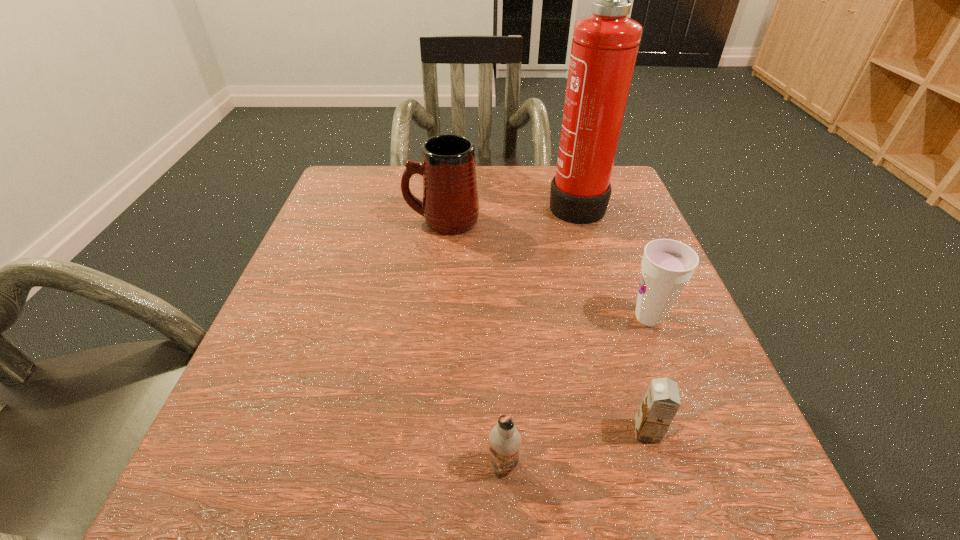
The width and height of the screenshot is (960, 540). I want to click on fire extinguisher, so click(x=604, y=49).

Where is `the second tallest object`? The width and height of the screenshot is (960, 540). the second tallest object is located at coordinates (450, 206).

Where is `the leftmost object`? the leftmost object is located at coordinates (450, 206).

This screenshot has width=960, height=540. What are the coordinates of `the third nearest object` in the screenshot? It's located at (667, 265).

Locate an element on the screen. cup is located at coordinates (667, 265).

The width and height of the screenshot is (960, 540). Identify the location of the left chocolate milk. (505, 440).

I want to click on the nearest object, so click(505, 440).

What are the coordinates of `the right chocolate milk` in the screenshot? It's located at (661, 402).

Locate an element on the screen. This screenshot has width=960, height=540. the farther chocolate milk is located at coordinates (661, 402).

Identify the location of vacant space located on the front-facing side of the fire extinguisher. (525, 202).